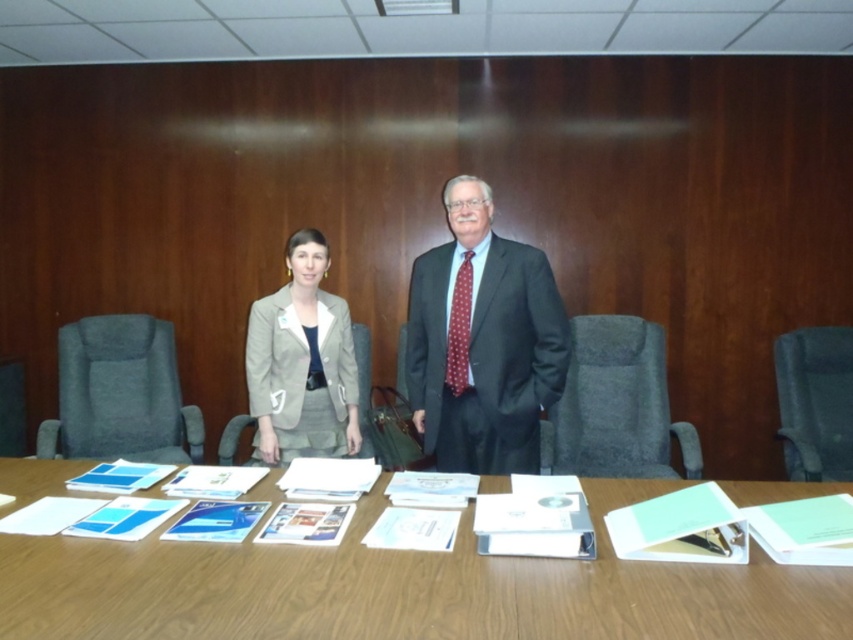
Question: Which point is farther from the camera taking this photo?

Choices:
 (A) (622, 448)
 (B) (231, 449)
 (C) (424, 564)

Answer: (A)

Question: Which object is the closest to the dark gray suit at center?

Choices:
 (A) gray fabric chair at left
 (B) gray fabric chair at center
 (C) beige fabric chair at center

Answer: (B)

Question: Does gray fabric chair at left have a smaller size compared to black fabric chair at right?

Choices:
 (A) yes
 (B) no

Answer: (B)

Question: Can you confirm if gray fabric chair at center is wider than beige fabric chair at center?

Choices:
 (A) no
 (B) yes

Answer: (B)

Question: Is gray fabric chair at left to the right of gray fabric chair at center from the viewer's perspective?

Choices:
 (A) yes
 (B) no

Answer: (B)

Question: Among these points, which one is farthest from the camera?

Choices:
 (A) (460, 317)
 (B) (39, 429)

Answer: (B)